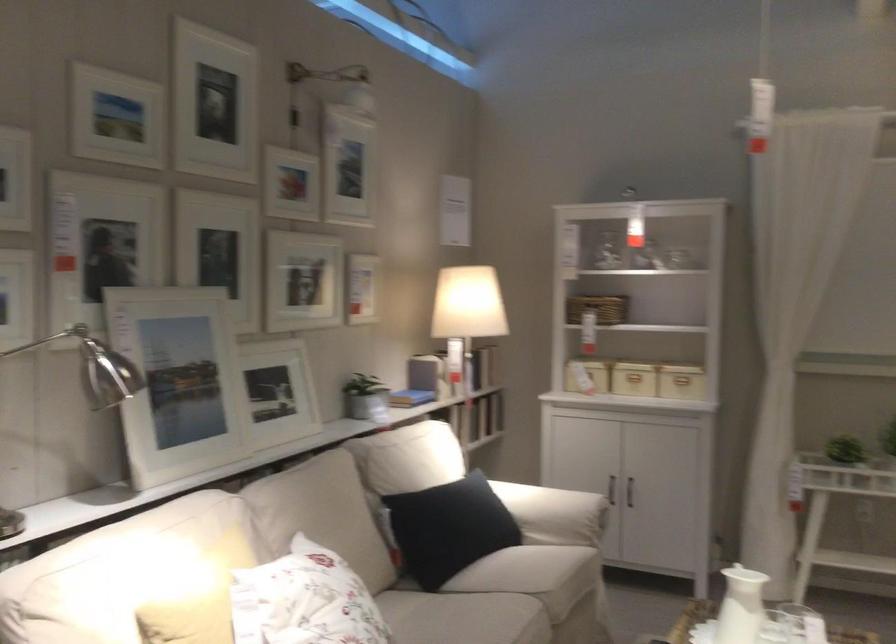
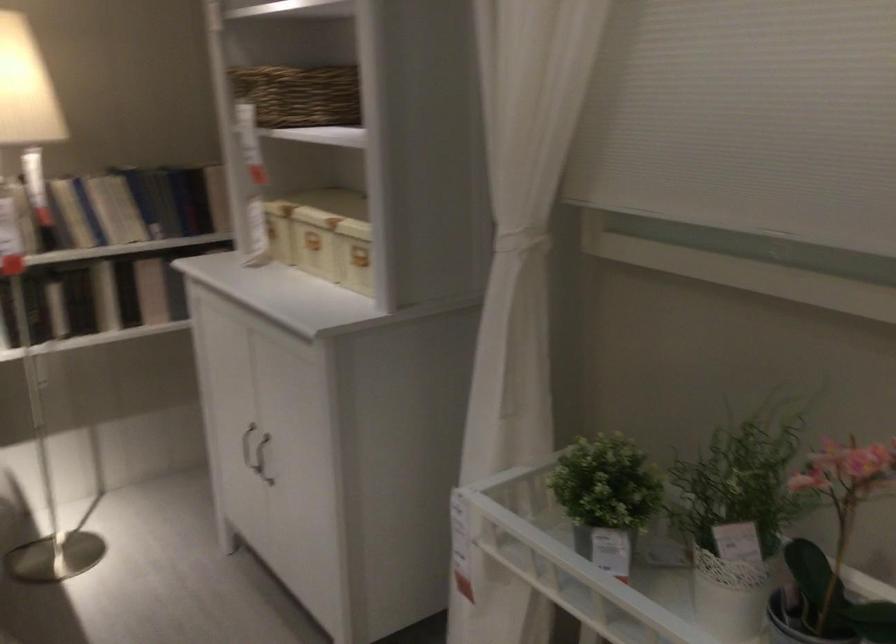
Find the pixel in the second image that matches pixel 640 487 in the first image.

(262, 459)